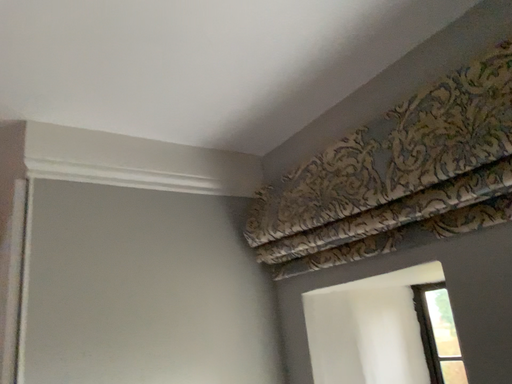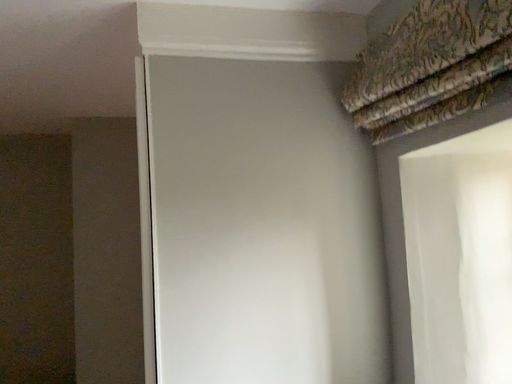
Question: How did the camera likely rotate when shooting the video?

Choices:
 (A) rotated left
 (B) rotated right

Answer: (A)